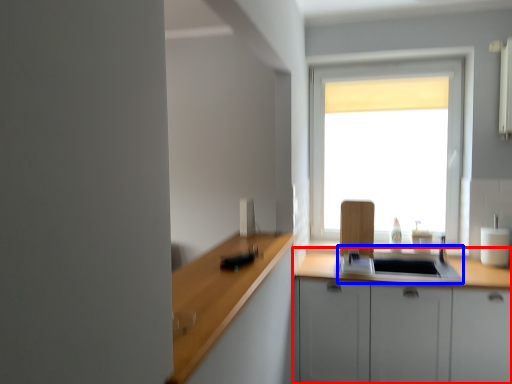
Question: Which of the following is the closest to the observer, cabinetry (highlighted by a red box) or sink (highlighted by a blue box)?

Choices:
 (A) cabinetry
 (B) sink

Answer: (A)